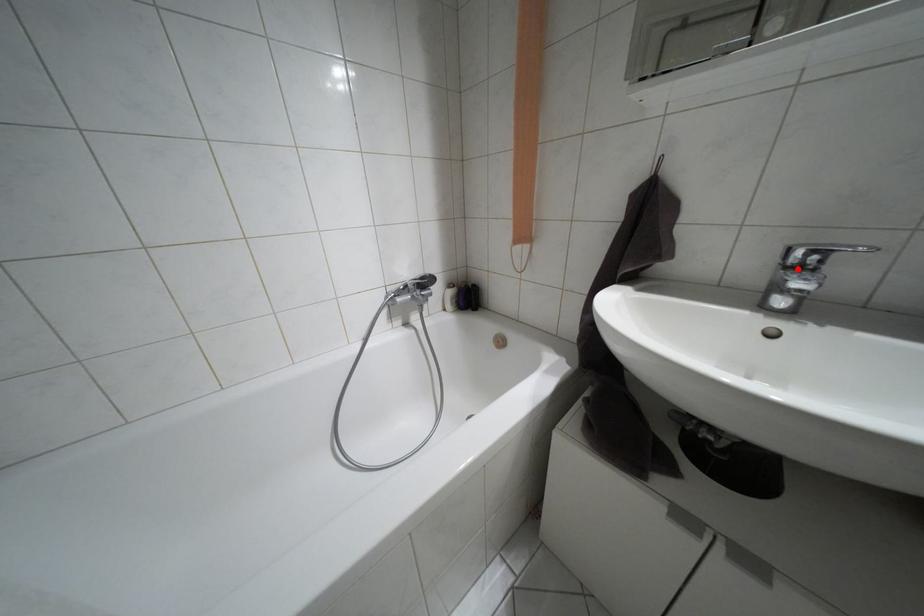
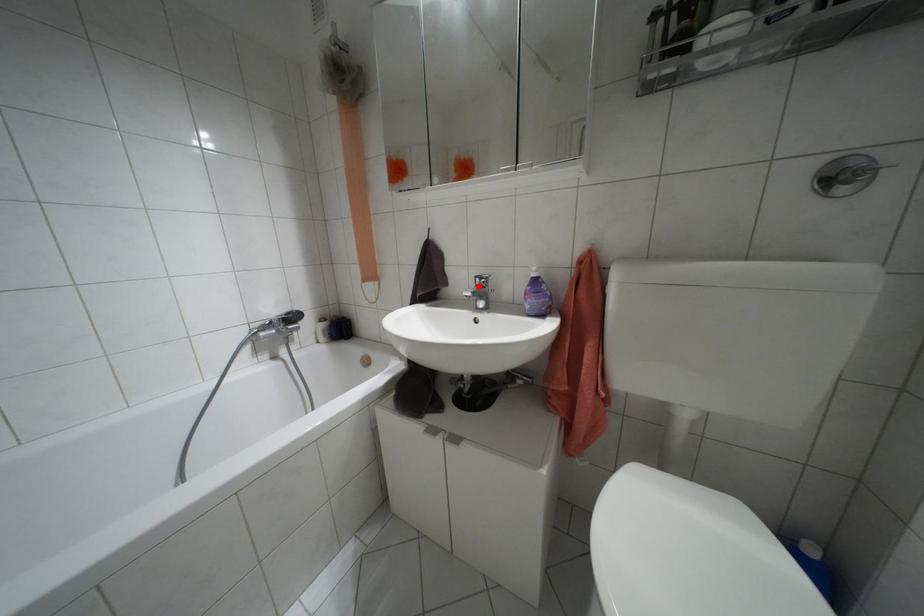
I am providing you with two images of the same scene from different viewpoints. A red point is marked on the first image and another point is marked on the second image. Is the red point in image1 aligned with the point shown in image2?

Yes